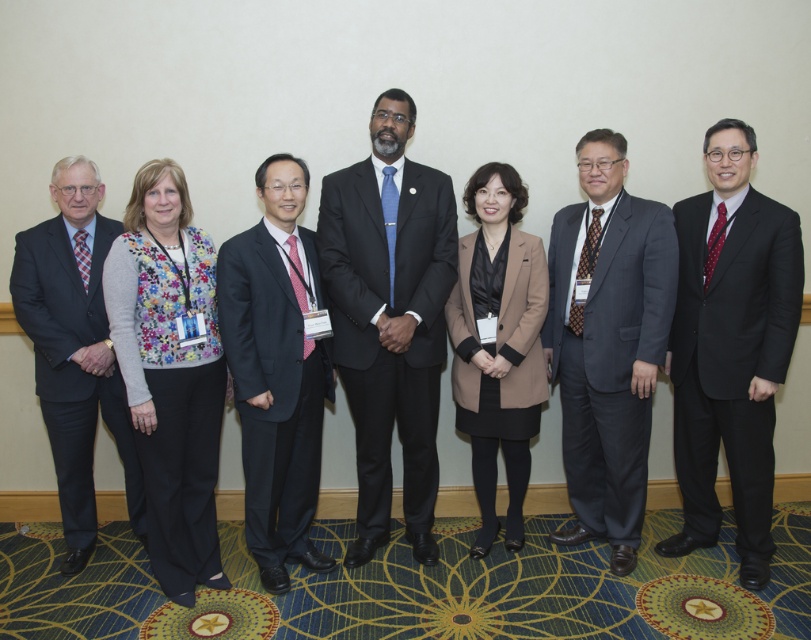
Is floral-patterned sweater at center positioned before navy wool suit at center?

Yes, it is.

Between floral-patterned sweater at center and navy wool suit at center, which one is positioned higher?

floral-patterned sweater at center is higher up.

The height and width of the screenshot is (640, 811). What do you see at coordinates (169, 372) in the screenshot? I see `floral-patterned sweater at center` at bounding box center [169, 372].

Find the location of a particular element. This screenshot has height=640, width=811. floral-patterned sweater at center is located at coordinates (169, 372).

Is navy wool suit at center bigger than dark gray suit at left?

Yes, navy wool suit at center is bigger than dark gray suit at left.

Which is in front, point (320, 448) or point (118, 442)?

Point (118, 442)

Which is behind, point (290, 324) or point (119, 449)?

Positioned behind is point (119, 449).

Find the location of a particular element. The width and height of the screenshot is (811, 640). navy wool suit at center is located at coordinates (272, 394).

Can you confirm if matte black suit at center is taller than tan fabric coat at center?

Indeed, matte black suit at center has a greater height compared to tan fabric coat at center.

Which of these two, matte black suit at center or tan fabric coat at center, stands taller?

matte black suit at center

Where is `matte black suit at center`? matte black suit at center is located at coordinates (389, 317).